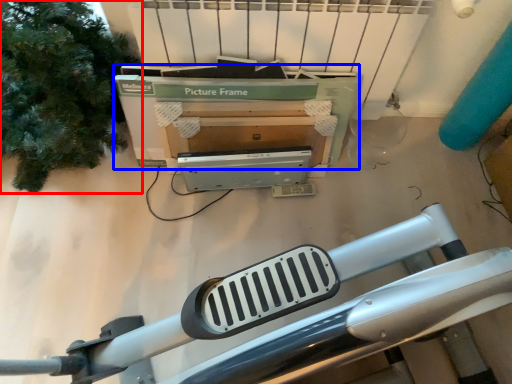
Question: Which point is further to the camera, tree (highlighted by a red box) or box (highlighted by a blue box)?

Choices:
 (A) tree
 (B) box

Answer: (B)